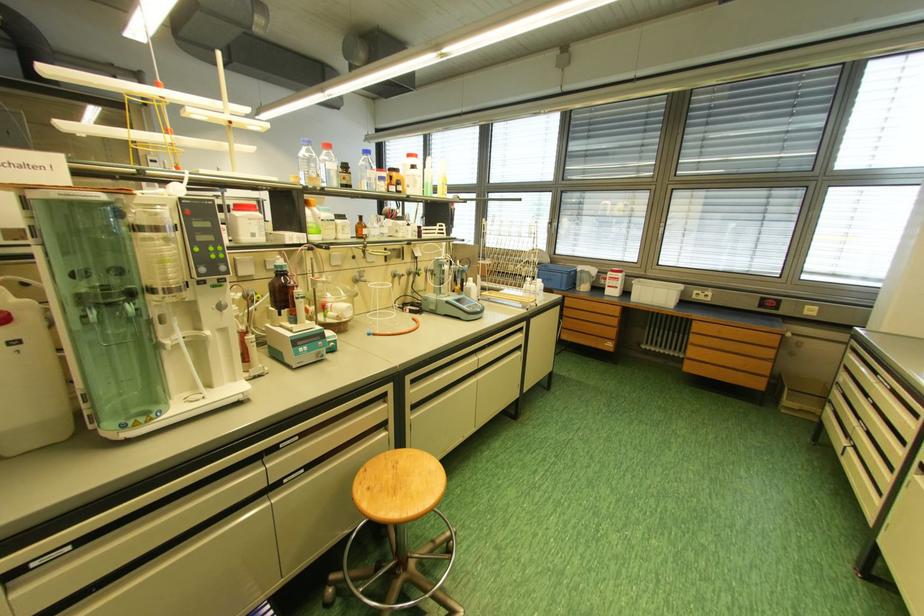
I want to click on red machine button, so click(x=769, y=302).